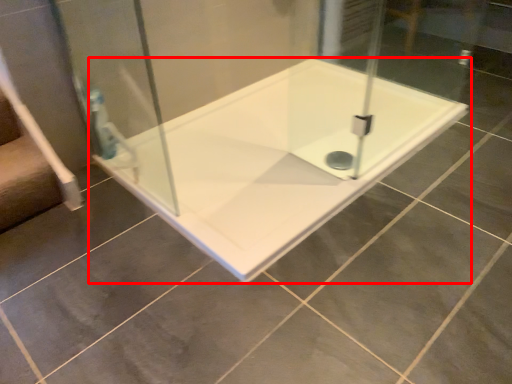
Question: In this image, where is bathtub (annotated by the red box) located relative to shower door?

Choices:
 (A) right
 (B) left

Answer: (A)